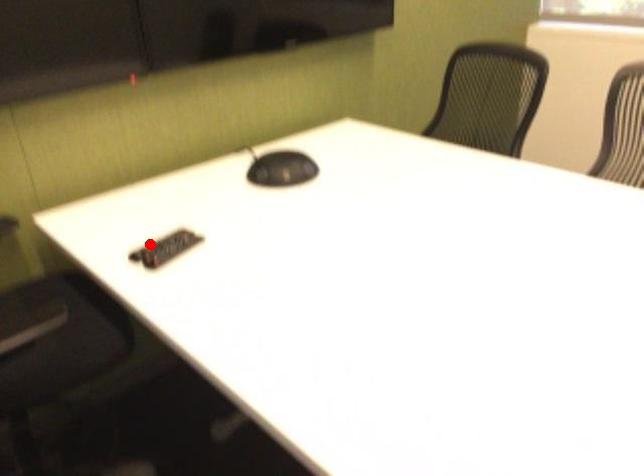
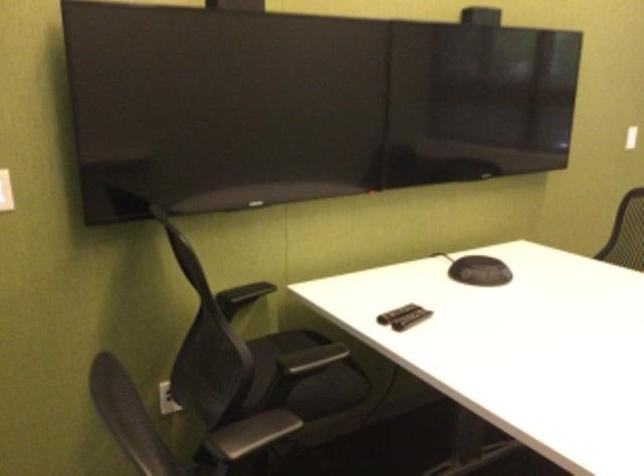
Locate, in the second image, the point that corresponds to the highlighted location in the first image.

(395, 313)